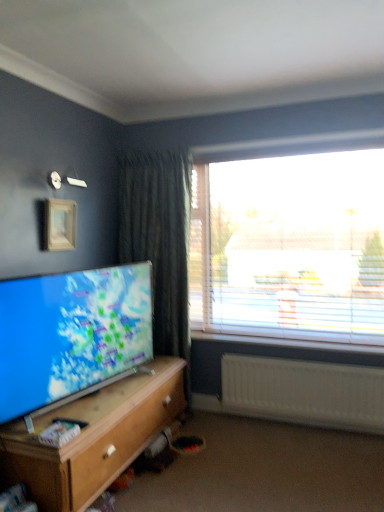
Question: Is matte screen tv at lower left to the right of wooden cabinet at lower left from the viewer's perspective?

Choices:
 (A) yes
 (B) no

Answer: (B)

Question: Can you confirm if matte screen tv at lower left is bigger than wooden cabinet at lower left?

Choices:
 (A) yes
 (B) no

Answer: (B)

Question: Is matte screen tv at lower left turned away from wooden cabinet at lower left?

Choices:
 (A) yes
 (B) no

Answer: (B)

Question: From a real-world perspective, is matte screen tv at lower left located higher than wooden cabinet at lower left?

Choices:
 (A) no
 (B) yes

Answer: (B)

Question: Is the surface of matte screen tv at lower left in direct contact with wooden cabinet at lower left?

Choices:
 (A) yes
 (B) no

Answer: (B)

Question: Does matte screen tv at lower left have a greater height compared to wooden cabinet at lower left?

Choices:
 (A) no
 (B) yes

Answer: (B)

Question: Does transparent plastic window at upper right have a greater width compared to matte screen tv at lower left?

Choices:
 (A) no
 (B) yes

Answer: (A)

Question: Is transparent plastic window at upper right bigger than matte screen tv at lower left?

Choices:
 (A) yes
 (B) no

Answer: (B)

Question: Is transparent plastic window at upper right to the left of matte screen tv at lower left from the viewer's perspective?

Choices:
 (A) yes
 (B) no

Answer: (B)

Question: Is transparent plastic window at upper right thinner than matte screen tv at lower left?

Choices:
 (A) no
 (B) yes

Answer: (B)

Question: Is transparent plastic window at upper right at the right side of matte screen tv at lower left?

Choices:
 (A) yes
 (B) no

Answer: (A)

Question: From the image's perspective, is transparent plastic window at upper right under matte screen tv at lower left?

Choices:
 (A) yes
 (B) no

Answer: (B)

Question: Considering the relative sizes of wooden cabinet at lower left and matte screen tv at lower left in the image provided, is wooden cabinet at lower left bigger than matte screen tv at lower left?

Choices:
 (A) no
 (B) yes

Answer: (B)